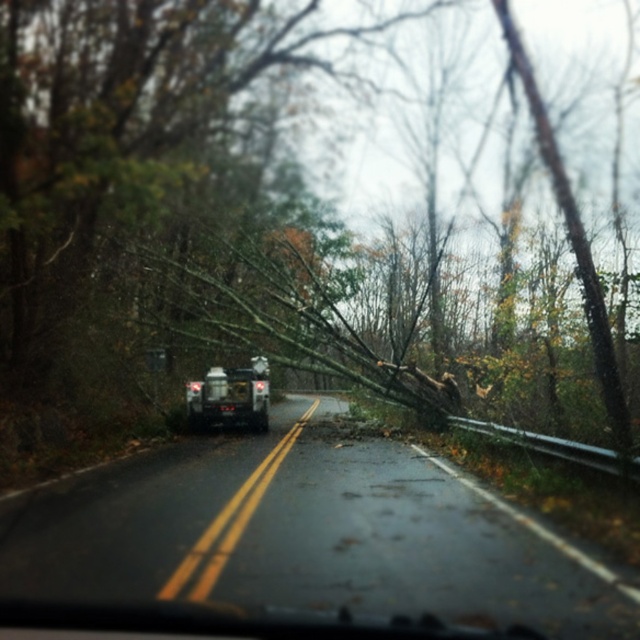
Is black asphalt road at center further to camera compared to metallic silver suv at center?

No, it is in front of metallic silver suv at center.

Is point (397, 600) more distant than point (234, 376)?

No, (397, 600) is in front of (234, 376).

The height and width of the screenshot is (640, 640). What are the coordinates of `black asphalt road at center` in the screenshot? It's located at (305, 534).

Is brown wood tree at center wider than metallic silver suv at center?

Indeed, brown wood tree at center has a greater width compared to metallic silver suv at center.

Can you confirm if brown wood tree at center is smaller than metallic silver suv at center?

Incorrect, brown wood tree at center is not smaller in size than metallic silver suv at center.

Is point (404, 397) positioned behind point (224, 369)?

No.

Image resolution: width=640 pixels, height=640 pixels. What are the coordinates of `brown wood tree at center` in the screenshot? It's located at (144, 196).

Is brown wood tree at center in front of black asphalt road at center?

No, brown wood tree at center is behind black asphalt road at center.

Who is more distant from viewer, [51,1] or [227,593]?

The point [51,1] is behind.

Find the location of `brown wood tree at center`. brown wood tree at center is located at coordinates (144, 196).